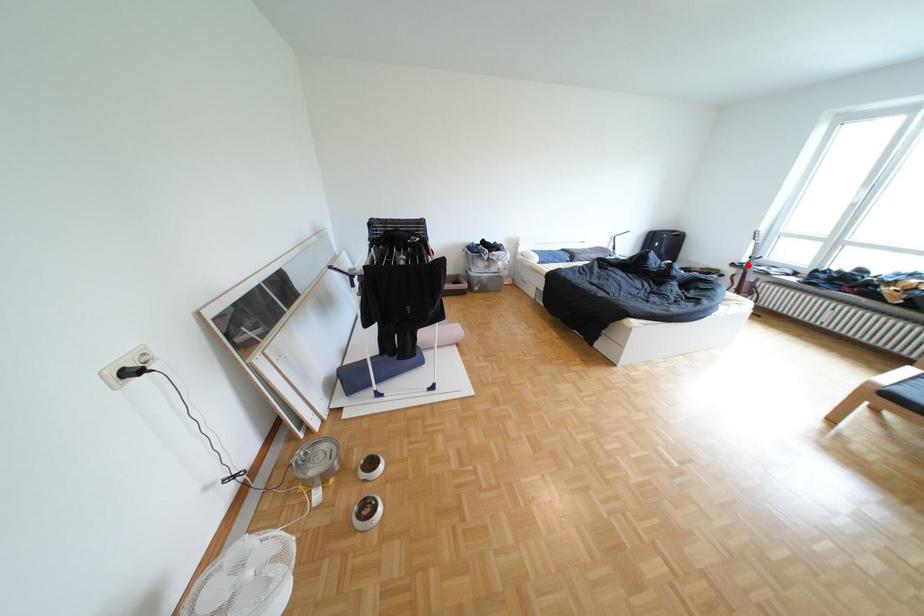
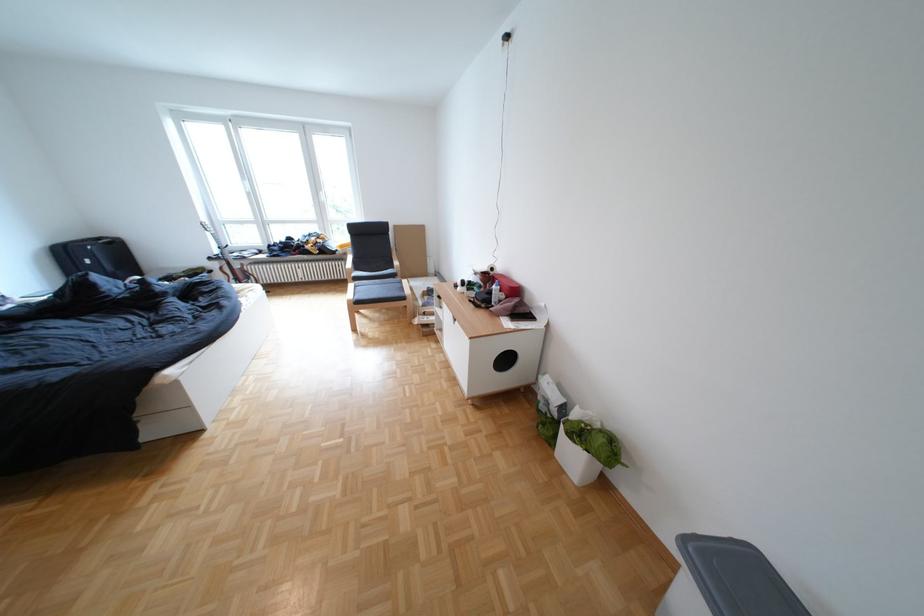
Question: I am providing you with two images of the same scene from different viewpoints. A red point is marked on the first image. Is the red point's position out of view in image 2?

Choices:
 (A) Yes
 (B) No

Answer: (B)